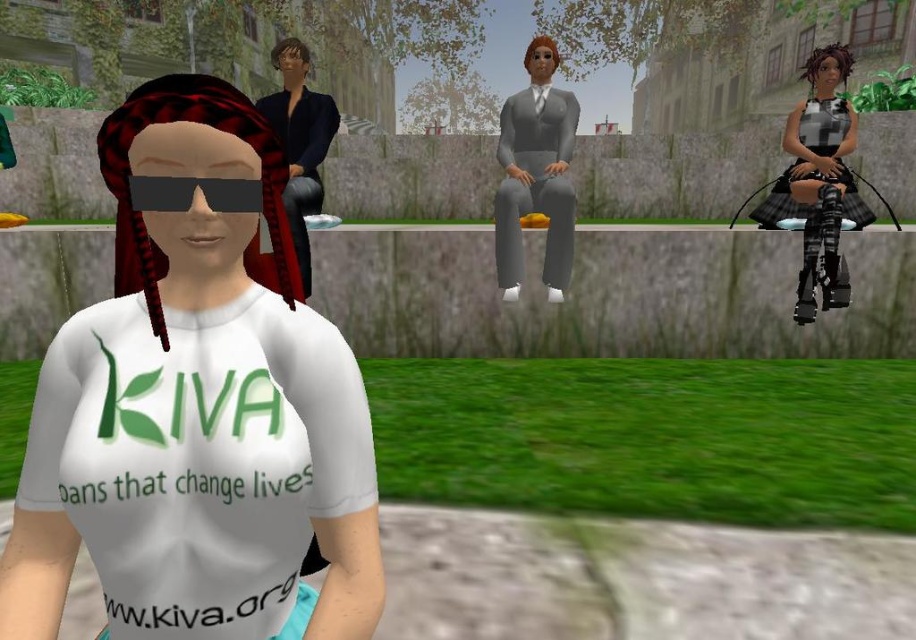
Question: Which of the following is the farthest from the observer?

Choices:
 (A) (290, 586)
 (B) (842, 113)
 (C) (554, 116)

Answer: (B)

Question: Can you confirm if white matte t-shirt at center is smaller than matte black jacket at upper left?

Choices:
 (A) no
 (B) yes

Answer: (B)

Question: In this image, where is white matte t-shirt at center located relative to checkered fabric dress at right?

Choices:
 (A) left
 (B) right

Answer: (A)

Question: Which point is closer to the camera?

Choices:
 (A) checkered fabric dress at right
 (B) white matte t-shirt at center
 (C) matte gray suit at center
 (D) matte black jacket at upper left

Answer: (B)

Question: Considering the real-world distances, which object is closest to the white matte t-shirt at center?

Choices:
 (A) matte black jacket at upper left
 (B) matte gray suit at center
 (C) checkered fabric dress at right

Answer: (A)

Question: Is checkered fabric dress at right smaller than matte gray suit at center?

Choices:
 (A) no
 (B) yes

Answer: (B)